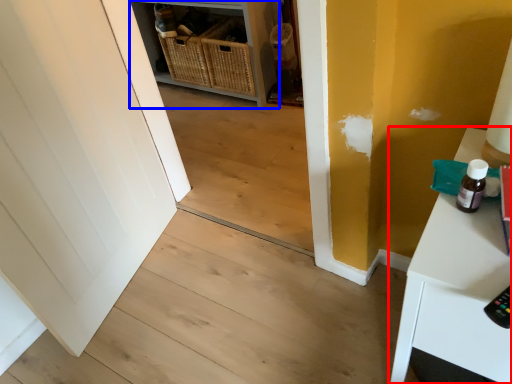
Question: Among these objects, which one is nearest to the camera, table (highlighted by a red box) or shelf (highlighted by a blue box)?

Choices:
 (A) table
 (B) shelf

Answer: (A)